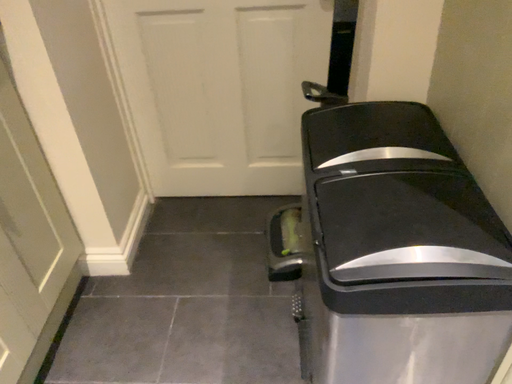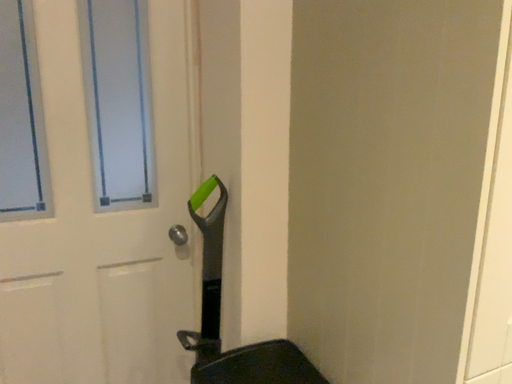
Question: How did the camera likely rotate when shooting the video?

Choices:
 (A) rotated upward
 (B) rotated downward

Answer: (A)